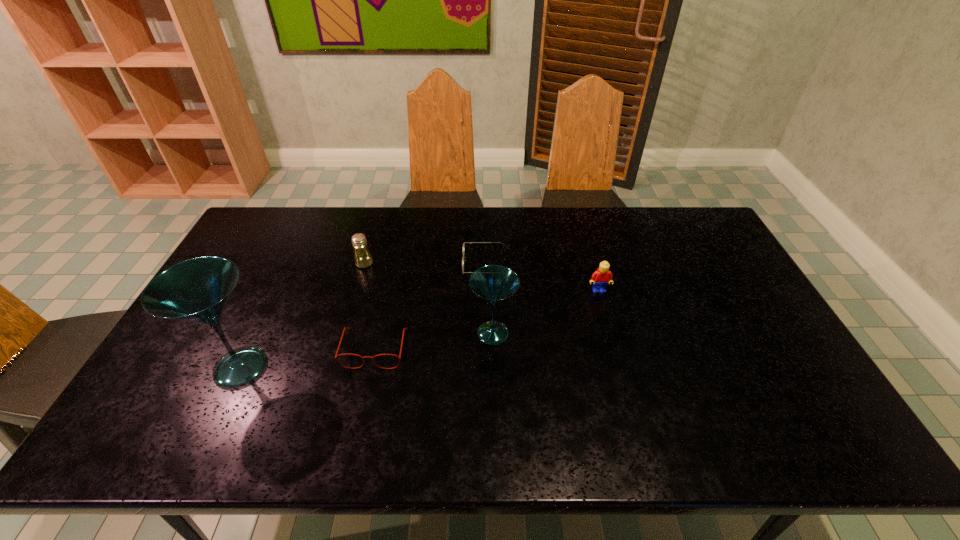
Locate an element on the screen. The image size is (960, 540). vacant spot to place a martini on the right is located at coordinates (712, 303).